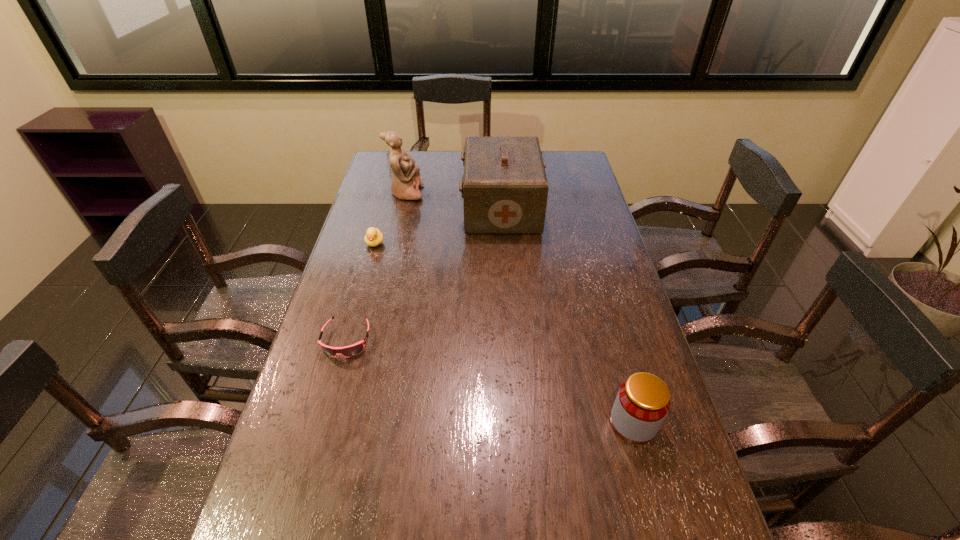
Locate an element on the screen. The height and width of the screenshot is (540, 960). unoccupied position between the second shortest object and the nearest object is located at coordinates (504, 333).

At what (x,y) coordinates should I click in order to perform the action: click on free space between the first-aid kit and the figurine. Please return your answer as a coordinate pair (x, y). The width and height of the screenshot is (960, 540). Looking at the image, I should click on (454, 201).

Where is `free area in between the first-aid kit and the duckling`? free area in between the first-aid kit and the duckling is located at coordinates (438, 226).

Where is `vacant point located between the figurine and the second shortest object`? This screenshot has height=540, width=960. vacant point located between the figurine and the second shortest object is located at coordinates (391, 218).

Image resolution: width=960 pixels, height=540 pixels. I want to click on vacant space in between the second nearest object and the third tallest object, so click(490, 381).

Identify the location of blank region between the jar and the goggles. (x=490, y=381).

In order to click on unoccupied area between the rightmost object and the duckling in this screenshot , I will do `click(504, 333)`.

At what (x,y) coordinates should I click in order to perform the action: click on free area in between the jar and the fourth object from left to right. Please return your answer as a coordinate pair (x, y). The width and height of the screenshot is (960, 540). Looking at the image, I should click on (567, 315).

The width and height of the screenshot is (960, 540). Identify the location of object that is the third closest one to the duckling. (348, 351).

In order to click on the closest object relative to the nearest object in this screenshot , I will do `click(348, 351)`.